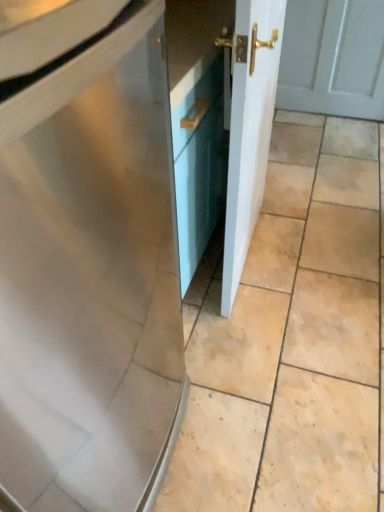
Question: Looking at the image, does beige matte tile at center seem bigger or smaller compared to white glossy door at center?

Choices:
 (A) small
 (B) big

Answer: (B)

Question: In the image, is beige matte tile at center on the left side or the right side of white glossy door at center?

Choices:
 (A) right
 (B) left

Answer: (B)

Question: From the image's perspective, is beige matte tile at center positioned above or below white glossy door at center?

Choices:
 (A) above
 (B) below

Answer: (B)

Question: Relative to beige matte tile at center, is white glossy door at center in front or behind?

Choices:
 (A) behind
 (B) front

Answer: (B)

Question: Considering the positions of white glossy door at center and beige matte tile at center in the image, is white glossy door at center wider or thinner than beige matte tile at center?

Choices:
 (A) wide
 (B) thin

Answer: (B)

Question: From a real-world perspective, is white glossy door at center physically located above or below beige matte tile at center?

Choices:
 (A) below
 (B) above

Answer: (B)

Question: Would you say white glossy door at center is to the left or to the right of beige matte tile at center in the picture?

Choices:
 (A) right
 (B) left

Answer: (A)